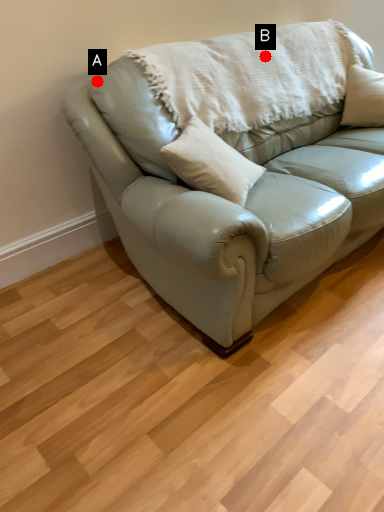
Question: Two points are circled on the image, labeled by A and B beside each circle. Which point appears farthest from the camera in this image?

Choices:
 (A) A is further
 (B) B is further

Answer: (B)